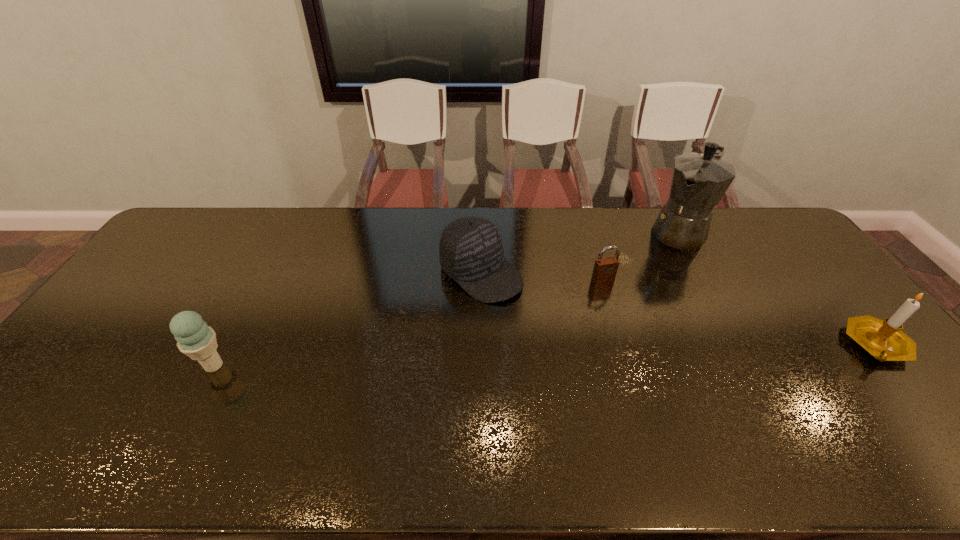
Where is `vacant space that's between the rightmost object and the tallest object`? This screenshot has width=960, height=540. vacant space that's between the rightmost object and the tallest object is located at coordinates (779, 287).

You are a GUI agent. You are given a task and a screenshot of the screen. Output one action in this format:
    pyautogui.click(x=<x>, y=<y>)
    Task: Click on the vacant point located between the leftmost object and the shortest object
    The width and height of the screenshot is (960, 540).
    Given the screenshot: What is the action you would take?
    point(408,323)

The width and height of the screenshot is (960, 540). In order to click on free point between the shortest object and the second object from left to right in this screenshot , I will do click(x=541, y=276).

Where is `empty space between the rightmost object and the leftmost object`? empty space between the rightmost object and the leftmost object is located at coordinates (545, 355).

Where is `object identified as the third closest to the tallest object`? The width and height of the screenshot is (960, 540). object identified as the third closest to the tallest object is located at coordinates (471, 252).

Select which object appears as the third closest to the fourth object from right to left. Please provide its 2D coordinates. Your answer should be formatted as a tuple, i.e. [(x, y)], where the tuple contains the x and y coordinates of a point satisfying the conditions above.

[(197, 340)]

Where is `vacant space that satisfies the following two spatial constraints: 1. on the back side of the ice cream; 2. on the left side of the baseball cap`? This screenshot has width=960, height=540. vacant space that satisfies the following two spatial constraints: 1. on the back side of the ice cream; 2. on the left side of the baseball cap is located at coordinates (263, 273).

Locate an element on the screen. free space that satisfies the following two spatial constraints: 1. on the back side of the coffeepot; 2. on the left side of the baseball cap is located at coordinates (481, 231).